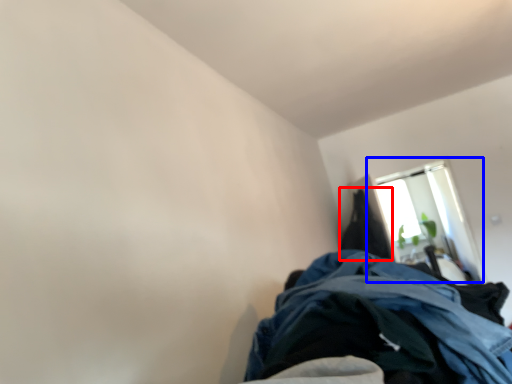
Question: Which object appears closest to the camera in this image, cloak (highlighted by a red box) or window (highlighted by a blue box)?

Choices:
 (A) cloak
 (B) window

Answer: (A)